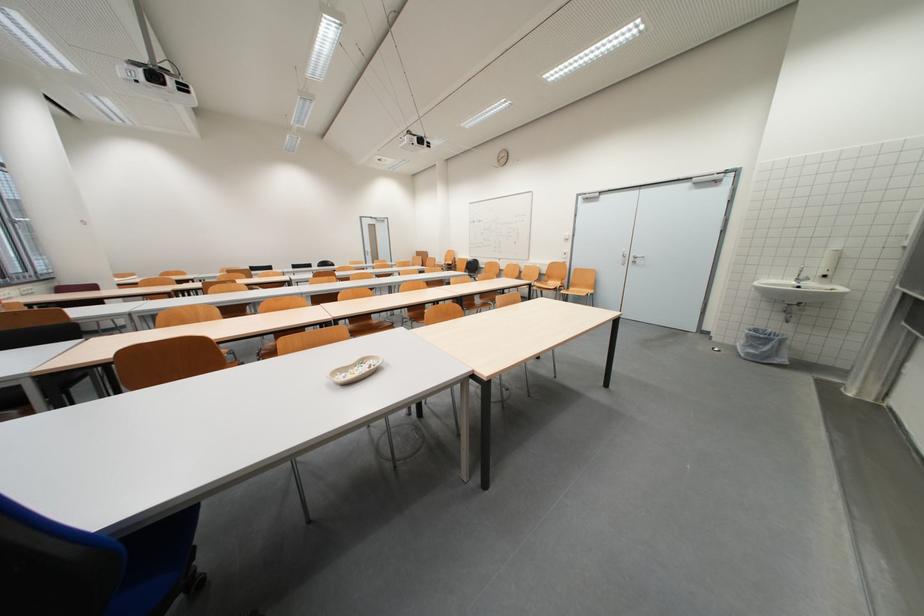
Describe the element at coordinates (561, 238) in the screenshot. The height and width of the screenshot is (616, 924). I see `the white light switch` at that location.